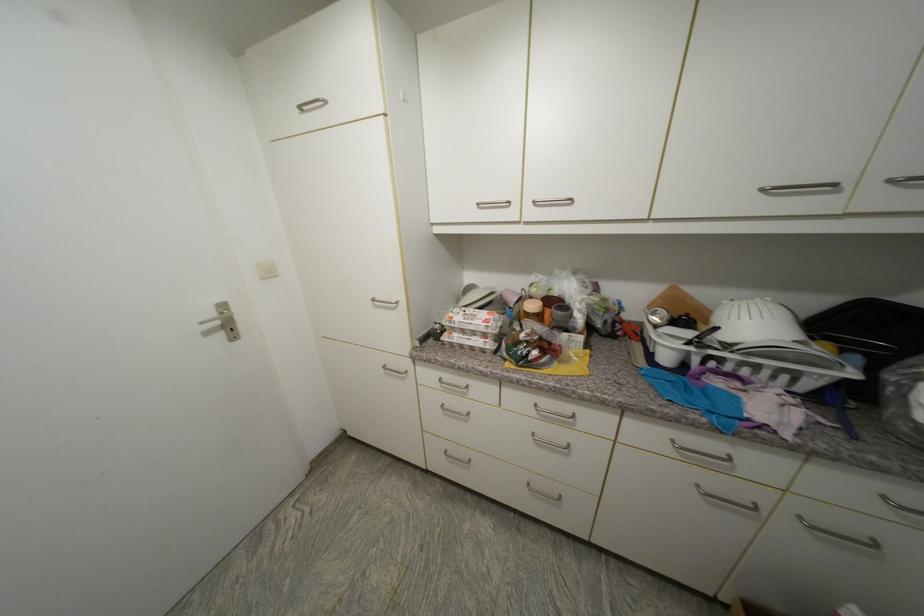
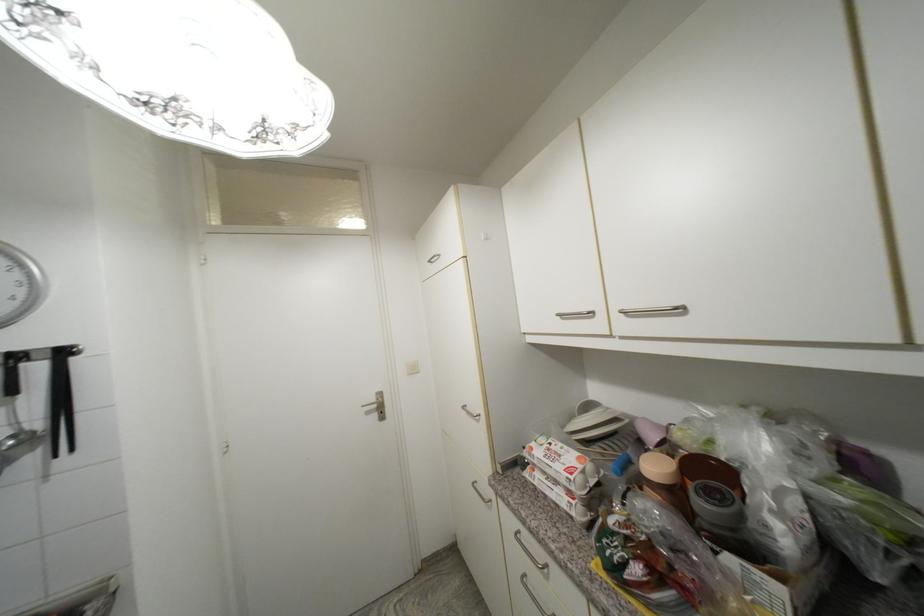
Find the pixel in the second image that matches pixel 562 273 in the first image.

(730, 410)